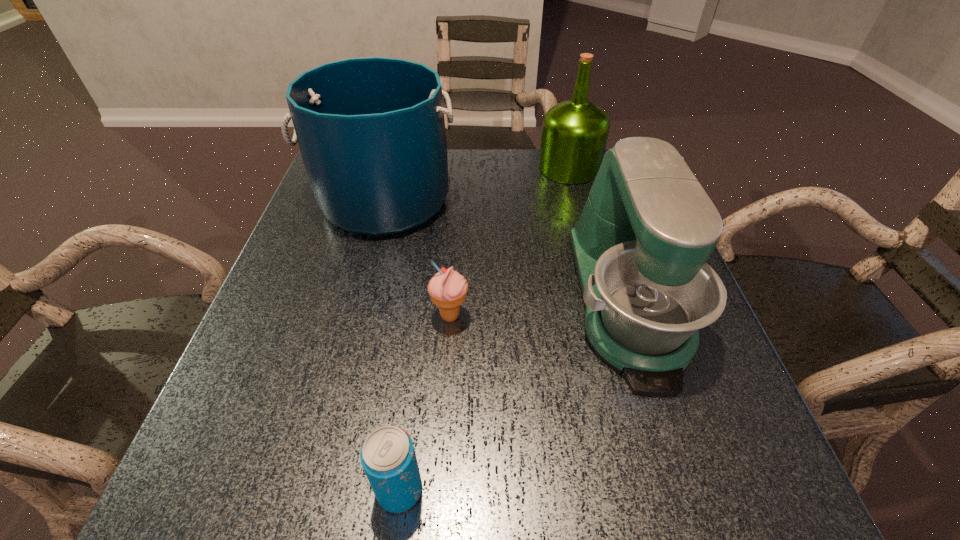
At what (x,y) coordinates should I click in order to perform the action: click on olive oil. Please return your answer as a coordinate pair (x, y). This screenshot has width=960, height=540. Looking at the image, I should click on (574, 134).

You are a GUI agent. You are given a task and a screenshot of the screen. Output one action in this format:
    pyautogui.click(x=<x>, y=<y>)
    Task: Click on the bucket
    
    Given the screenshot: What is the action you would take?
    (371, 131)

This screenshot has width=960, height=540. Find the location of `mixer`. mixer is located at coordinates (640, 247).

The width and height of the screenshot is (960, 540). I want to click on icecream, so click(447, 289).

Identify the location of soda can. This screenshot has width=960, height=540. (388, 457).

You are a GUI agent. You are given a task and a screenshot of the screen. Output one action in this format:
    pyautogui.click(x=<x>, y=<y>)
    Task: Click on the vacant space located on the right of the olive oil
    This screenshot has height=540, width=960.
    Given the screenshot: What is the action you would take?
    pyautogui.click(x=618, y=168)

The height and width of the screenshot is (540, 960). Identify the location of free space located on the front of the bucket. (337, 382).

Where is `vacant area situated 0.070m on the front-facing side of the mixer`? Image resolution: width=960 pixels, height=540 pixels. vacant area situated 0.070m on the front-facing side of the mixer is located at coordinates (670, 438).

I want to click on vacant space located on the left of the icecream, so click(x=274, y=316).

Locate an element on the screen. The height and width of the screenshot is (540, 960). blank area located 0.300m on the back of the nearest object is located at coordinates (421, 310).